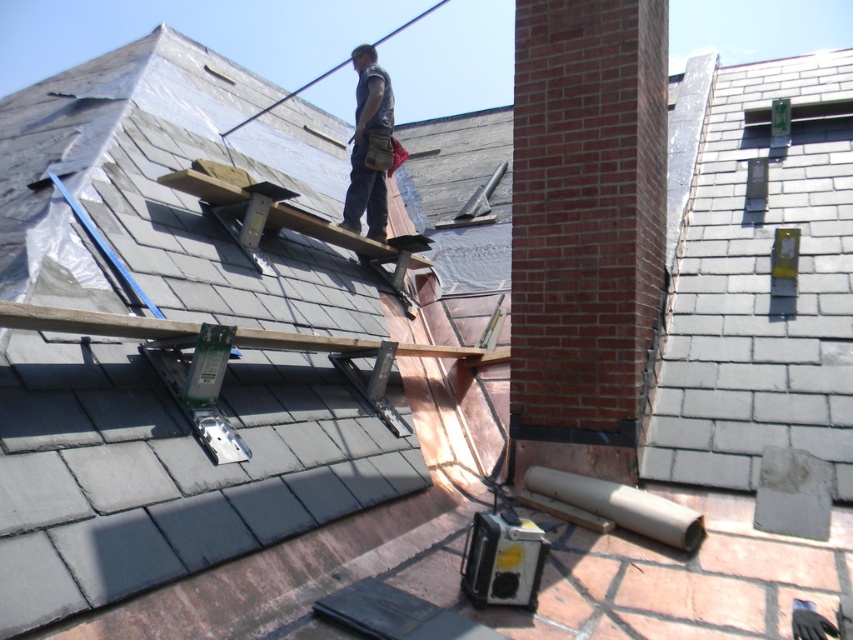
Question: Does brown wooden beam at center appear on the left side of brown canvas tool belt at center?

Choices:
 (A) yes
 (B) no

Answer: (B)

Question: Which point is farther to the camera?

Choices:
 (A) brown canvas tool belt at center
 (B) brown wooden beam at center

Answer: (A)

Question: Which point appears farthest from the camera in this image?

Choices:
 (A) (372, 72)
 (B) (54, 323)

Answer: (A)

Question: In this image, where is brown wooden beam at center located relative to brown canvas tool belt at center?

Choices:
 (A) below
 (B) above

Answer: (A)

Question: Observing the image, what is the correct spatial positioning of brown wooden beam at center in reference to brown canvas tool belt at center?

Choices:
 (A) left
 (B) right

Answer: (B)